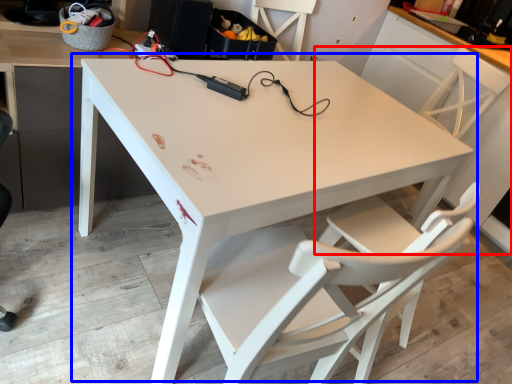
Question: Which of the following is the farthest to the observer, chair (highlighted by a red box) or table (highlighted by a blue box)?

Choices:
 (A) chair
 (B) table

Answer: (A)